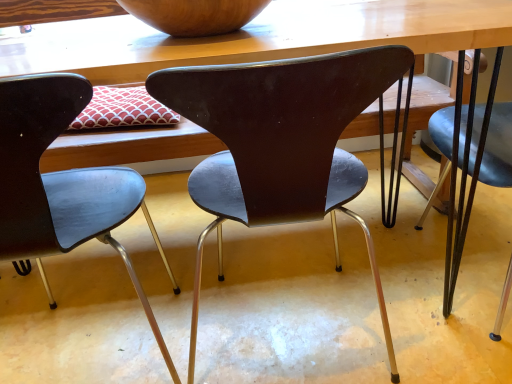
Question: In terms of width, does wooden bowl at upper center look wider or thinner when compared to matte black chair at center, the 2th chair positioned from the right?

Choices:
 (A) wide
 (B) thin

Answer: (B)

Question: Is wooden bowl at upper center in front of or behind matte black chair at center, the 2th chair positioned from the right, in the image?

Choices:
 (A) behind
 (B) front

Answer: (A)

Question: Estimate the real-world distances between objects in this image. Which object is closer to the wooden table at center?

Choices:
 (A) wooden bowl at upper center
 (B) matte black chair at center, the 2th chair positioned from the right
 (C) matte black chair at center, positioned as the first chair in right-to-left order

Answer: (A)

Question: Which is farther from the matte black chair at center, positioned as the 2th chair in left-to-right order?

Choices:
 (A) wooden table at center
 (B) matte black chair at center, the 2th chair positioned from the right
 (C) wooden bowl at upper center

Answer: (C)